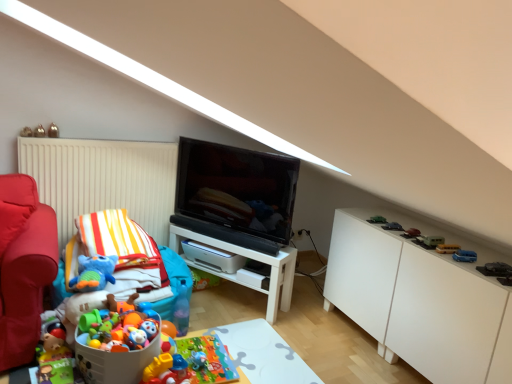
Find the location of a particular element. vacant region to the left of shiny red car at right, the fifth toy when ordered from top to bottom is located at coordinates (391, 228).